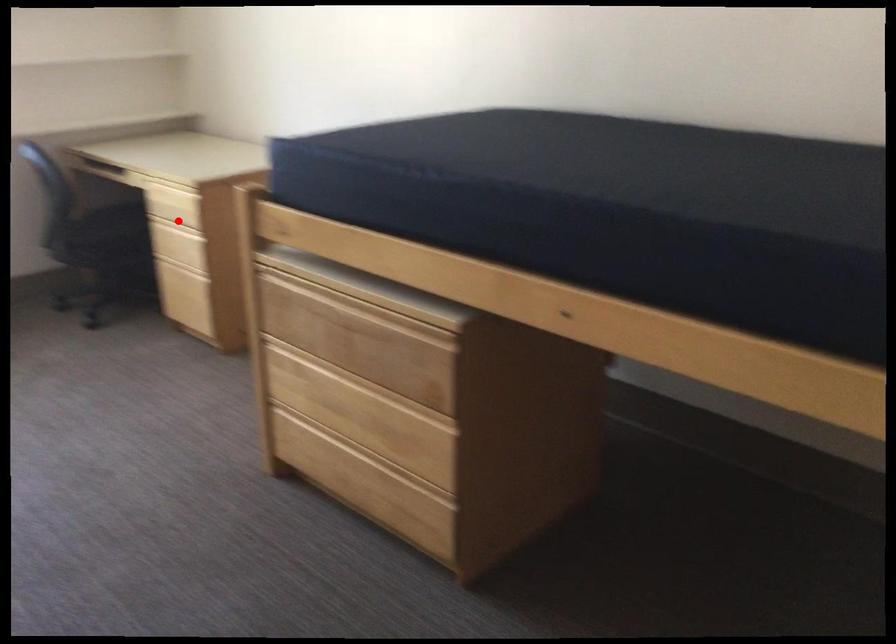
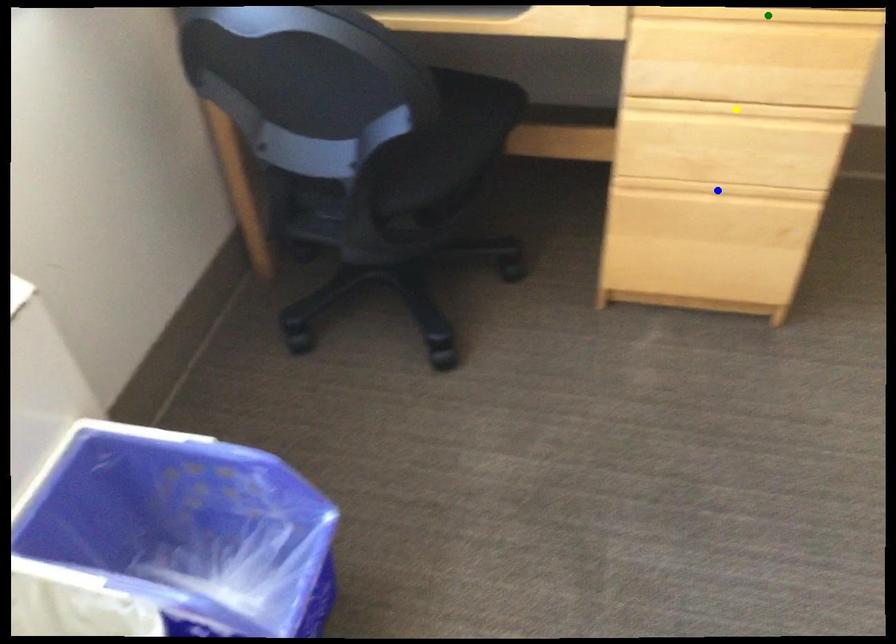
Question: I am providing you with two images of the same scene from different viewpoints. A red point is marked on the first image. You are given multiple points on the second image. Which point in image 2 represents the same 3d spot as the red point in image 1?

Choices:
 (A) yellow point
 (B) blue point
 (C) green point

Answer: (A)